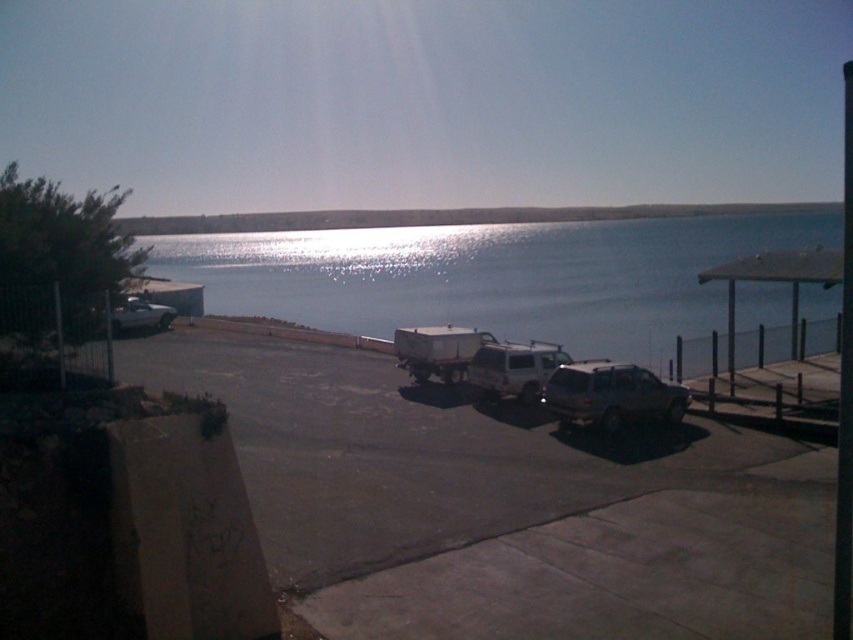
This screenshot has height=640, width=853. In order to click on blue water at center in this screenshot , I will do `click(495, 276)`.

Is point (575, 248) behind point (120, 323)?

Yes, it is behind point (120, 323).

What are the coordinates of `blue water at center` in the screenshot? It's located at (495, 276).

Can you confirm if dark gray asphalt parking lot at center is positioned to the right of white matte truck at left?

Indeed, dark gray asphalt parking lot at center is positioned on the right side of white matte truck at left.

Does dark gray asphalt parking lot at center have a greater height compared to white matte truck at left?

Correct, dark gray asphalt parking lot at center is much taller as white matte truck at left.

Is point (515, 449) closer to camera compared to point (120, 332)?

Yes, point (515, 449) is closer to viewer.

Image resolution: width=853 pixels, height=640 pixels. Find the location of `dark gray asphalt parking lot at center`. dark gray asphalt parking lot at center is located at coordinates (502, 506).

Measure the distance from satin silver suv at center to white matte truck at left.

A distance of 12.97 meters exists between satin silver suv at center and white matte truck at left.

Locate an element on the screen. The height and width of the screenshot is (640, 853). satin silver suv at center is located at coordinates (611, 394).